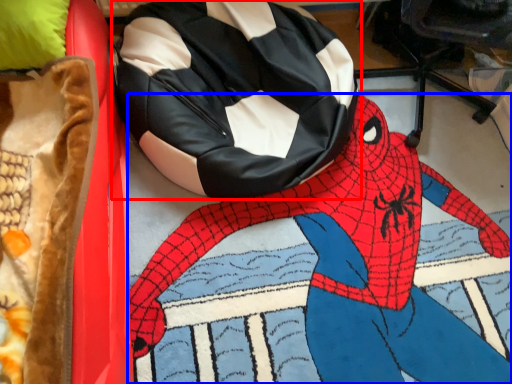
Question: Which object appears farthest to the camera in this image, bean bag chair (highlighted by a red box) or person (highlighted by a blue box)?

Choices:
 (A) bean bag chair
 (B) person

Answer: (A)